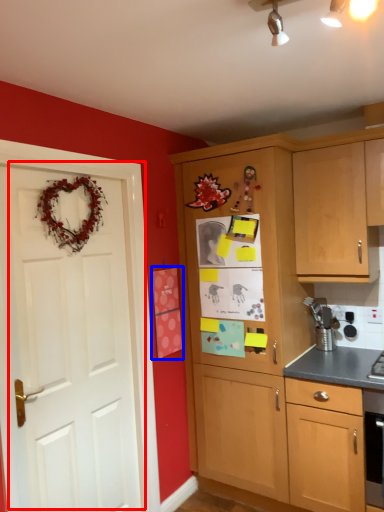
Question: Which object is closer to the camera taking this photo, door (highlighted by a red box) or postcard (highlighted by a blue box)?

Choices:
 (A) door
 (B) postcard

Answer: (A)